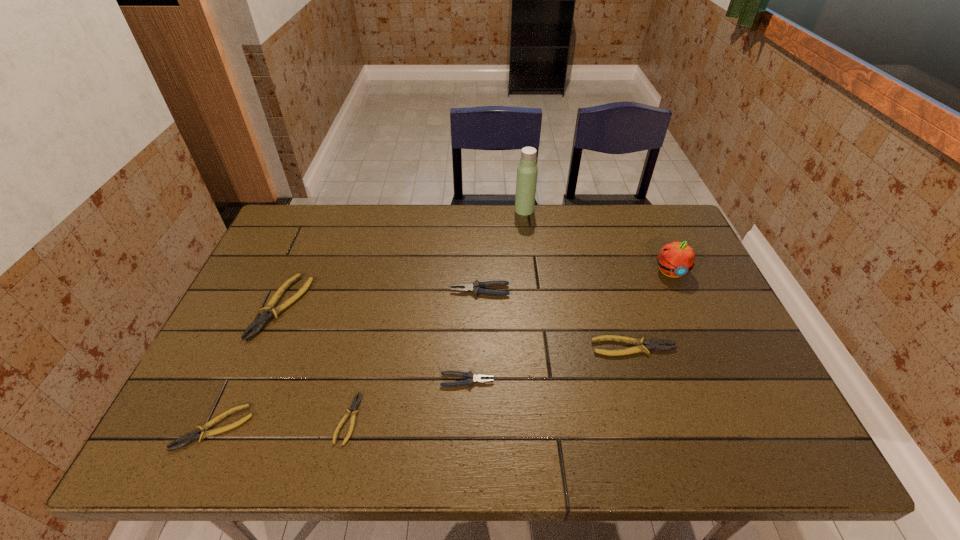
The width and height of the screenshot is (960, 540). Identify the location of vacant region located 0.060m on the right of the third smallest yellow pliers. (699, 347).

Locate an element on the screen. The width and height of the screenshot is (960, 540). vacant space located at the gripping part of the nearer gray pliers is located at coordinates (548, 381).

At what (x,y) coordinates should I click in order to perform the action: click on free region located on the back of the second shortest object. Please return your answer as a coordinate pair (x, y). The image size is (960, 540). Looking at the image, I should click on (246, 359).

At what (x,y) coordinates should I click in order to perform the action: click on free location located 0.100m on the back of the fourth pliers from right to left. Please return your answer as a coordinate pair (x, y). Image resolution: width=960 pixels, height=540 pixels. Looking at the image, I should click on (362, 358).

Find the location of `object present at the far edge`. object present at the far edge is located at coordinates (527, 170).

Locate an element on the screen. The width and height of the screenshot is (960, 540). object that is at the right edge is located at coordinates click(x=675, y=259).

Identify the location of object present at the near left corner. The height and width of the screenshot is (540, 960). (195, 435).

Find the location of `vacant point at the far edge`. vacant point at the far edge is located at coordinates (496, 224).

Identify the location of vacant space at the near edge. The height and width of the screenshot is (540, 960). (637, 427).

Locate an element on the screen. Image resolution: width=960 pixels, height=540 pixels. vacant region at the left edge is located at coordinates (241, 325).